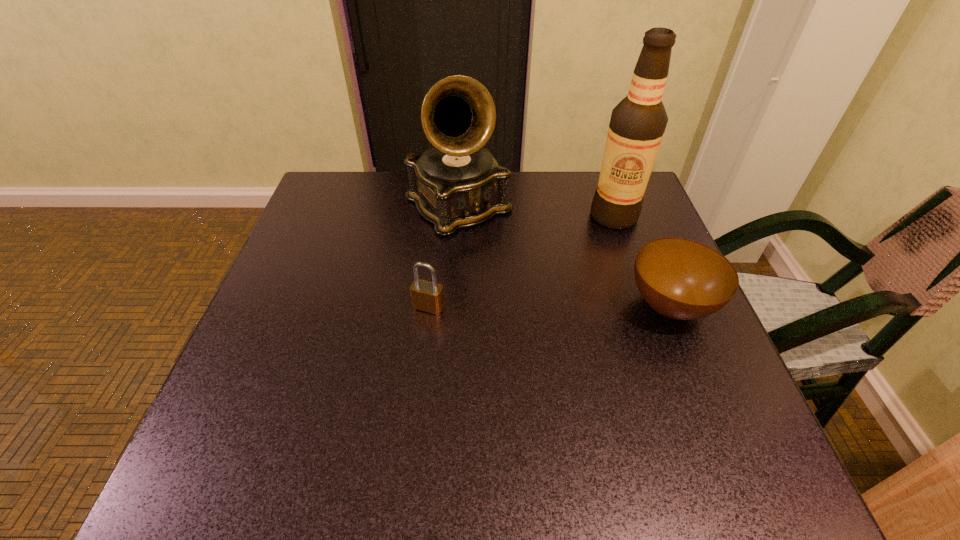
In order to click on object that is the third nearest to the alcohol in this screenshot , I will do `click(427, 296)`.

Point out which object is positioned as the second nearest to the alcohol. Please provide its 2D coordinates. Your answer should be formatted as a tuple, i.e. [(x, y)], where the tuple contains the x and y coordinates of a point satisfying the conditions above.

[(457, 183)]

You are a GUI agent. You are given a task and a screenshot of the screen. Output one action in this format:
    pyautogui.click(x=<x>, y=<y>)
    Task: Click on the free space that satisfies the following two spatial constraints: 1. on the back side of the alcohol; 2. on the right side of the padlock
    
    Given the screenshot: What is the action you would take?
    pyautogui.click(x=439, y=216)

The width and height of the screenshot is (960, 540). Find the location of `free point that satisfies the following two spatial constraints: 1. on the front side of the bowl; 2. on the right side of the alcohol`. free point that satisfies the following two spatial constraints: 1. on the front side of the bowl; 2. on the right side of the alcohol is located at coordinates (645, 306).